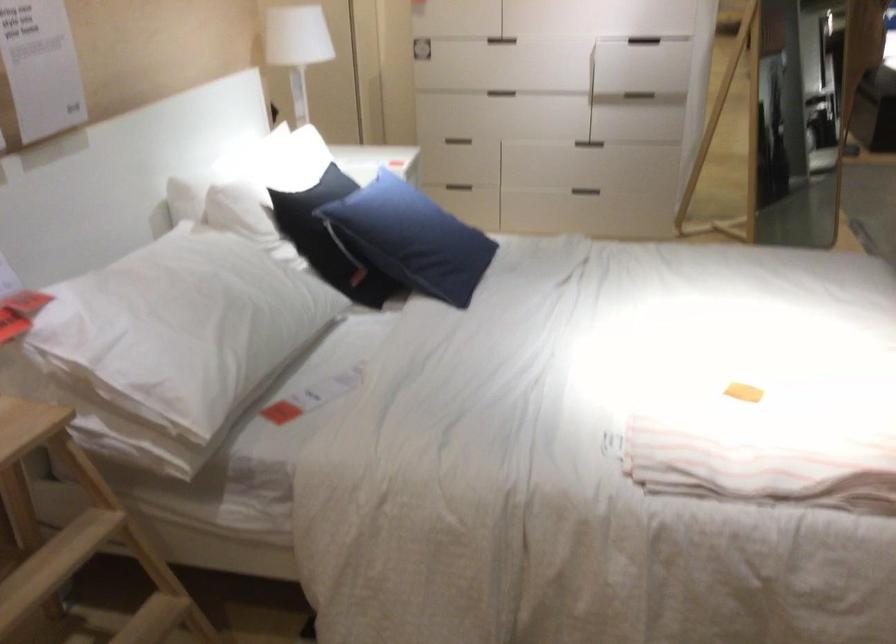
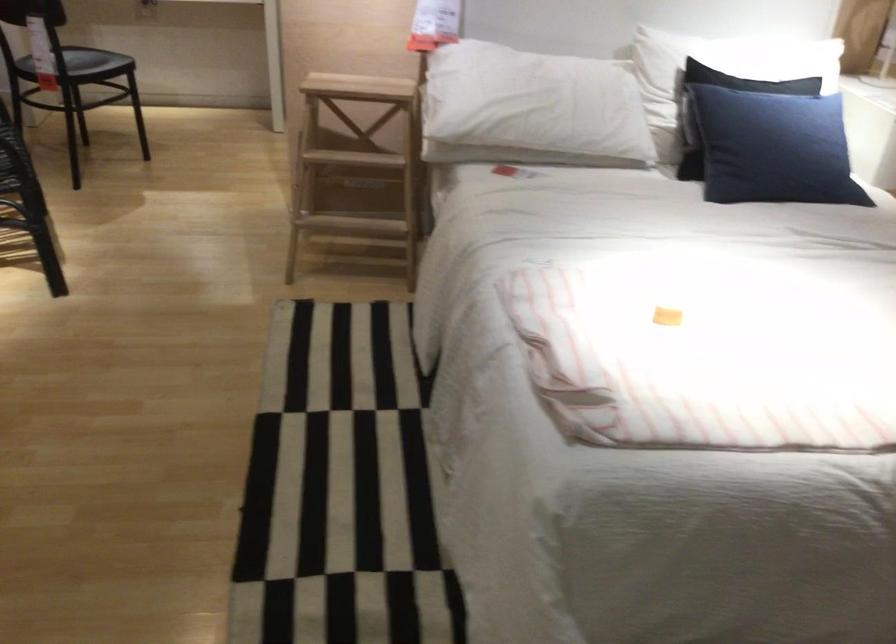
Where in the second image is the point corresponding to point (795, 389) from the first image?

(702, 355)